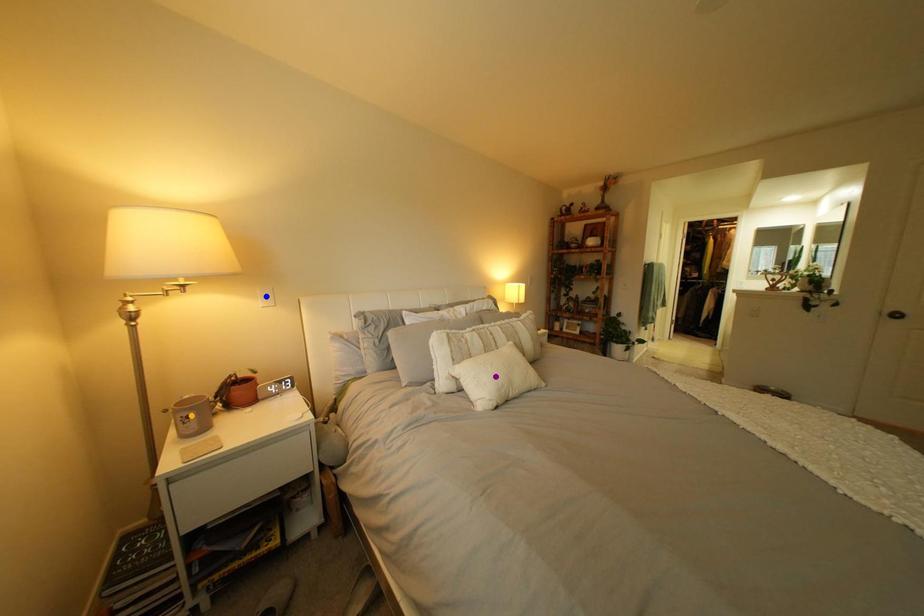
Order these from nearest to farthest:
purple point | orange point | blue point

orange point → purple point → blue point